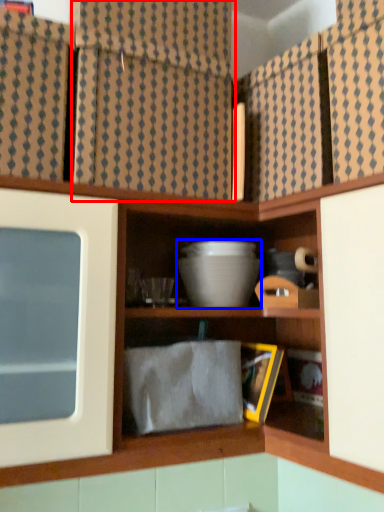
Question: Among these objects, which one is farthest to the camera, curtain (highlighted by a red box) or mixing bowl (highlighted by a blue box)?

Choices:
 (A) curtain
 (B) mixing bowl

Answer: (B)